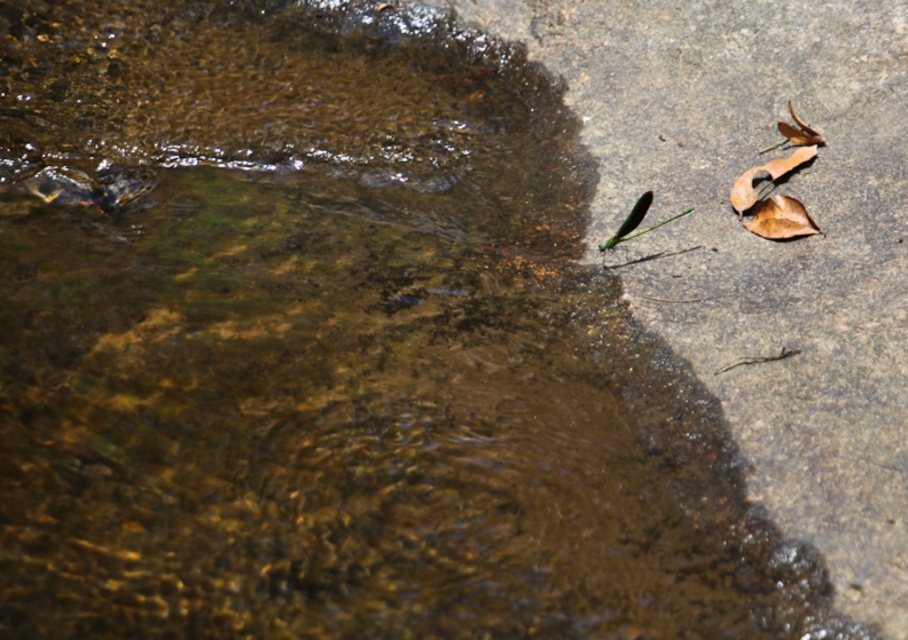
Which of these two, brown/dry leaf at right or brown matte leaf at right, stands taller?

With more height is brown matte leaf at right.

Who is higher up, brown/dry leaf at right or brown matte leaf at right?

brown matte leaf at right is higher up.

Identify the location of brown/dry leaf at right. This screenshot has height=640, width=908. (780, 218).

Image resolution: width=908 pixels, height=640 pixels. I want to click on brown/dry leaf at right, so click(780, 218).